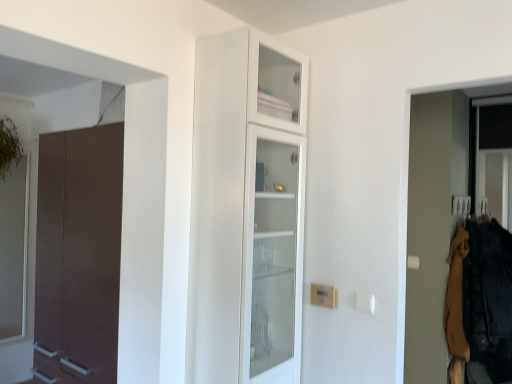
Question: Is white glass cabinet at center touching brown woolen sweater at right, the first clothing when ordered from left to right?

Choices:
 (A) no
 (B) yes

Answer: (A)

Question: Can you confirm if white glass cabinet at center is positioned to the right of brown woolen sweater at right, the second clothing viewed from the right?

Choices:
 (A) no
 (B) yes

Answer: (A)

Question: Is white glass cabinet at center turned away from brown woolen sweater at right, the first clothing when ordered from left to right?

Choices:
 (A) no
 (B) yes

Answer: (A)

Question: From a real-world perspective, is white glass cabinet at center beneath brown woolen sweater at right, the second clothing viewed from the right?

Choices:
 (A) no
 (B) yes

Answer: (A)

Question: From a real-world perspective, is white glass cabinet at center physically above brown woolen sweater at right, the first clothing when ordered from left to right?

Choices:
 (A) yes
 (B) no

Answer: (A)

Question: Can you confirm if white glass cabinet at center is smaller than brown woolen sweater at right, the first clothing when ordered from left to right?

Choices:
 (A) yes
 (B) no

Answer: (B)

Question: Is dark brown fabric at right, arranged as the 2th clothing when viewed from the left, positioned beyond the bounds of brown woolen sweater at right, the second clothing viewed from the right?

Choices:
 (A) no
 (B) yes

Answer: (B)

Question: Can you confirm if dark brown fabric at right, arranged as the 2th clothing when viewed from the left, is shorter than brown woolen sweater at right, the first clothing when ordered from left to right?

Choices:
 (A) yes
 (B) no

Answer: (B)

Question: Does dark brown fabric at right, arranged as the 2th clothing when viewed from the left, have a greater width compared to brown woolen sweater at right, the second clothing viewed from the right?

Choices:
 (A) yes
 (B) no

Answer: (A)

Question: Can you confirm if dark brown fabric at right, marked as the 1th clothing in a right-to-left arrangement, is thinner than brown woolen sweater at right, the first clothing when ordered from left to right?

Choices:
 (A) yes
 (B) no

Answer: (B)

Question: Is dark brown fabric at right, marked as the 1th clothing in a right-to-left arrangement, behind brown woolen sweater at right, the first clothing when ordered from left to right?

Choices:
 (A) no
 (B) yes

Answer: (A)

Question: Is dark brown fabric at right, marked as the 1th clothing in a right-to-left arrangement, oriented away from brown woolen sweater at right, the second clothing viewed from the right?

Choices:
 (A) yes
 (B) no

Answer: (A)

Question: Is brown woolen sweater at right, the first clothing when ordered from left to right, not close to dark brown fabric at right, marked as the 1th clothing in a right-to-left arrangement?

Choices:
 (A) yes
 (B) no

Answer: (B)